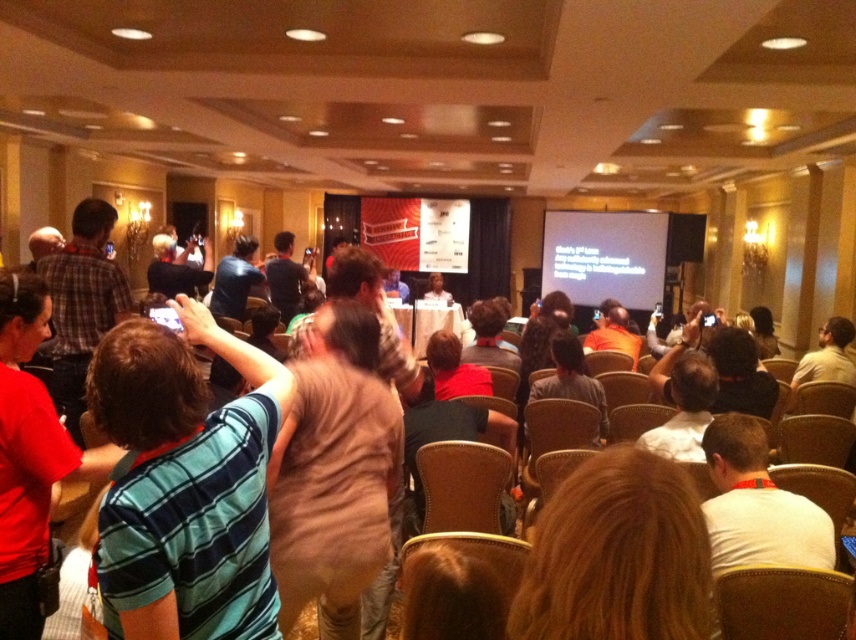
Question: Estimate the real-world distances between objects in this image. Which object is closer to the light brown leather chair at center?

Choices:
 (A) dark blue shirt at center
 (B) brown leather chair at lower right
 (C) white fabric shirt at center

Answer: (C)

Question: Which object appears closest to the camera in this image?

Choices:
 (A) blue striped shirt at center
 (B) white fabric shirt at center
 (C) dark blue shirt at center

Answer: (B)

Question: Can you confirm if matte red shirt at center is positioned above matte brown shirt at center?

Choices:
 (A) no
 (B) yes

Answer: (A)

Question: Does dark blue shirt at center have a lesser width compared to orange shirt at center?

Choices:
 (A) yes
 (B) no

Answer: (A)

Question: Which object appears closest to the camera in this image?

Choices:
 (A) red shirt at left
 (B) brown leather chair at center
 (C) white fabric shirt at center
 (D) green plaid shirt at center

Answer: (D)

Question: Does blue striped shirt at center have a lesser width compared to orange shirt at center?

Choices:
 (A) no
 (B) yes

Answer: (B)